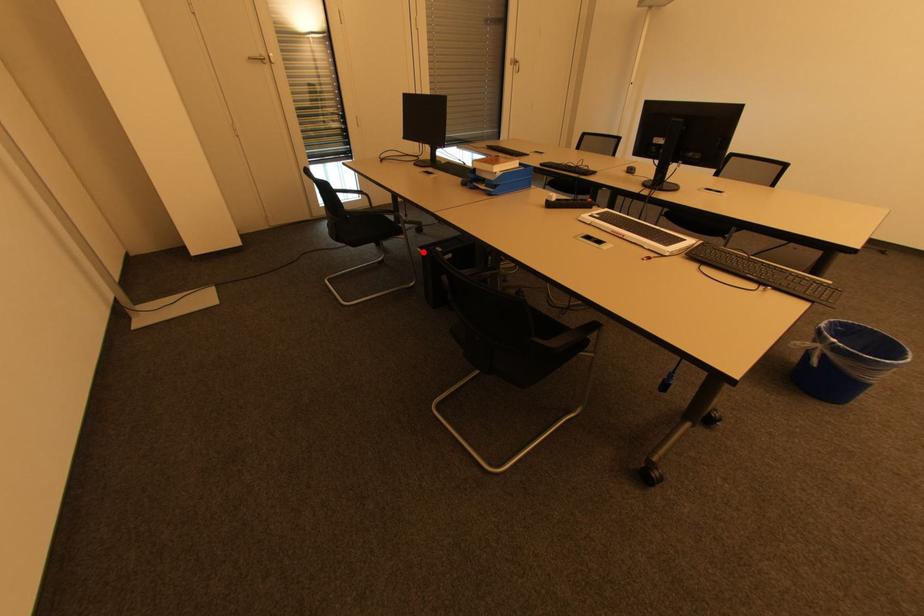
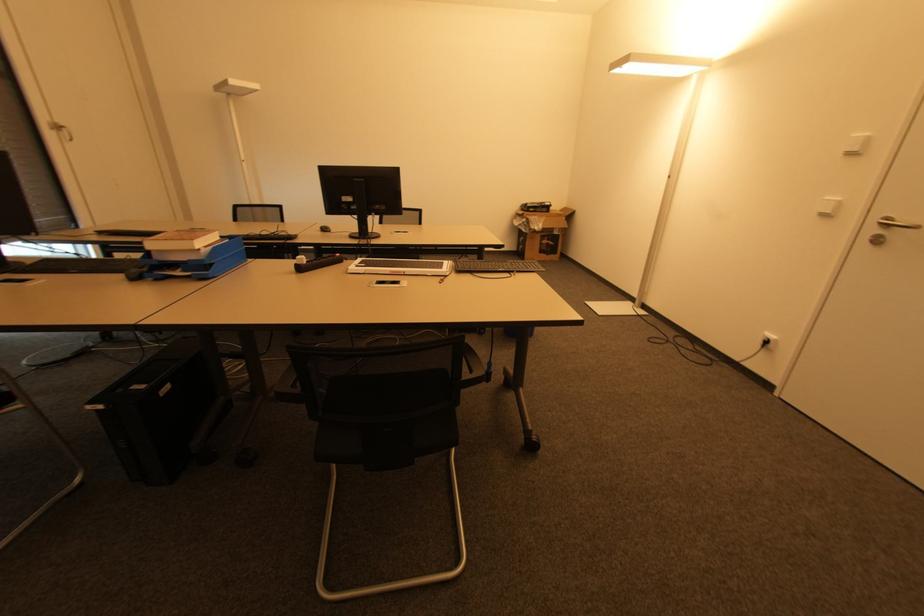
Find the pixel in the second image that matches the highlighted location in the first image.

(101, 408)